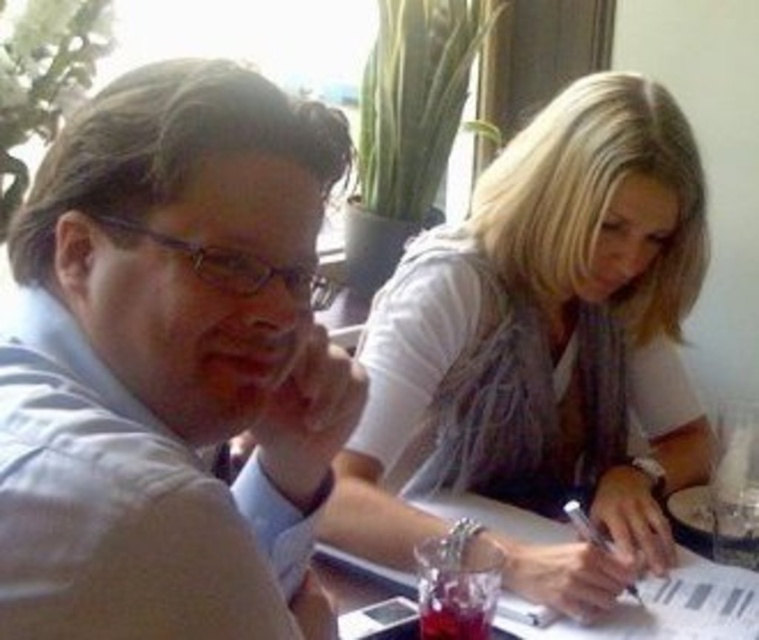
Who is more distant from viewer, (420, 388) or (499, 525)?

The point (499, 525) is more distant.

Is point (687, 410) positioned before point (546, 528)?

That is False.

Between point (498, 369) and point (580, 625), which one is positioned in front?

Positioned in front is point (580, 625).

Where is `white fabric shirt at upper right`? white fabric shirt at upper right is located at coordinates (543, 348).

Between light blue shirt at center and clear plastic table at center, which one is positioned lower?

clear plastic table at center is lower down.

Is point (142, 301) positioned in front of point (660, 628)?

Yes, point (142, 301) is in front of point (660, 628).

Who is more forward, (222, 144) or (476, 502)?

Positioned in front is point (222, 144).

Identify the location of light blue shirt at center. Image resolution: width=759 pixels, height=640 pixels. (169, 362).

Image resolution: width=759 pixels, height=640 pixels. In order to click on light blue shirt at center in this screenshot , I will do `click(169, 362)`.

Can you confirm if light blue shirt at center is wider than white fabric shirt at upper right?

Incorrect, light blue shirt at center's width does not surpass white fabric shirt at upper right's.

Is point (39, 337) farther from camera compared to point (646, 394)?

That is False.

The image size is (759, 640). I want to click on light blue shirt at center, so click(169, 362).